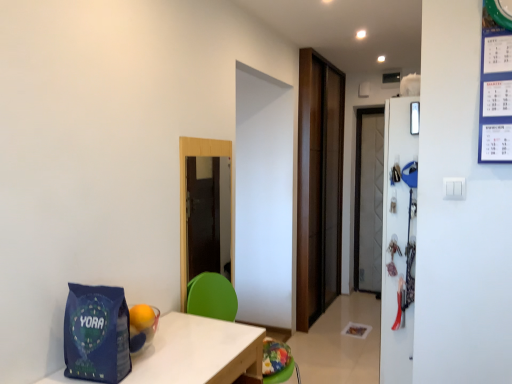
I want to click on free space in front of brown wood door at center, so click(x=333, y=336).